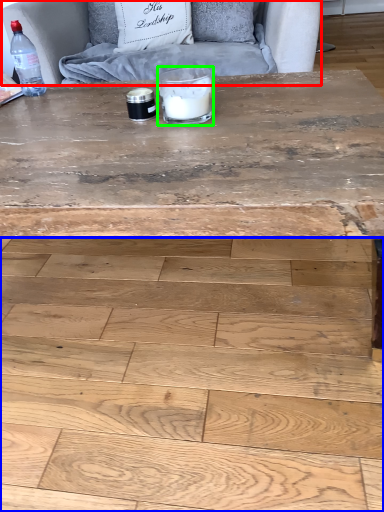
Question: Which object is the farthest from armchair (highlighted by a red box)? Choose among these: plywood (highlighted by a blue box) or candle holder (highlighted by a green box).

Choices:
 (A) plywood
 (B) candle holder

Answer: (A)